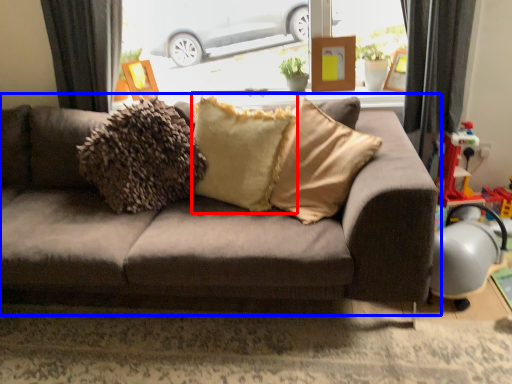
Question: Which object appears farthest to the camera in this image, pillow (highlighted by a red box) or studio couch (highlighted by a blue box)?

Choices:
 (A) pillow
 (B) studio couch

Answer: (A)